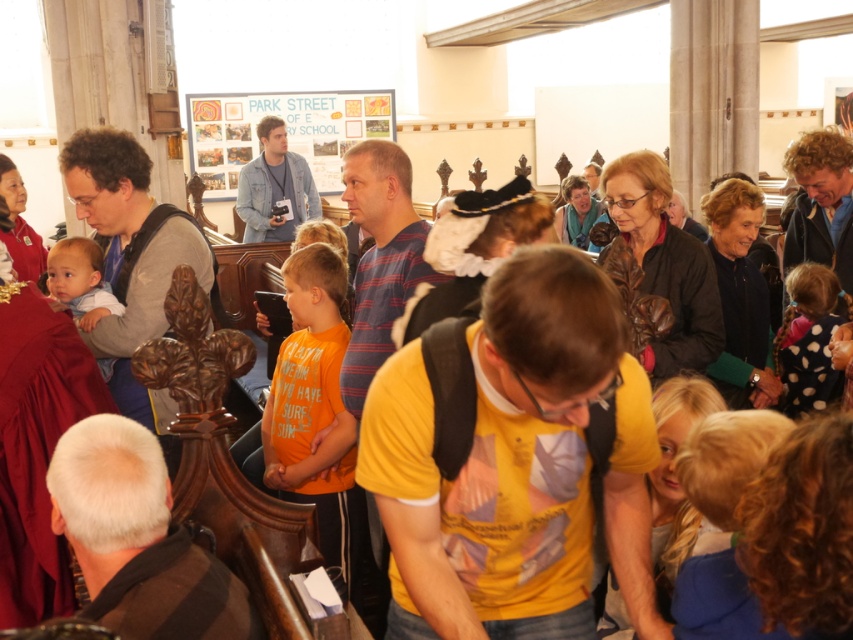
You are attending a historical event and notice two items in the scene. The first is the polka dot dress at right, and the second is the light blue fabric at left. From your vantage point, which item is closer to you?

The polka dot dress at right is closer to you because the light blue fabric at left is behind it.

You are standing in the church and want to take a photo of both the orange cotton shirt at center and the polka dot dress at right. Since you can only focus on one subject at a time, which one should you focus on first to ensure the other is still somewhat in focus?

You should focus on the orange cotton shirt at center first because it is closer to the viewer than the polka dot dress at right. By focusing on the closer subject, the background subject will still be somewhat in focus due to the depth of field.

You are standing in the church and want to take a photo of both the orange cotton shirt at center and the polka dot dress at right. Which object should you position first in your camera frame to ensure both are visible?

Since the orange cotton shirt at center is to the left of the polka dot dress at right, you should position the orange cotton shirt at center first on the left side of the frame to ensure both are visible.